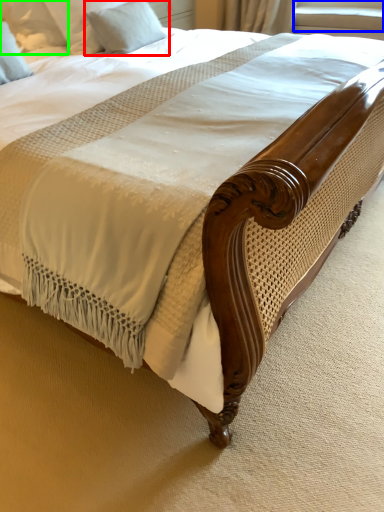
Question: Which object is positioned farthest from pillow (highlighted by a red box)? Select from window screen (highlighted by a blue box) and pillow (highlighted by a green box).

Choices:
 (A) window screen
 (B) pillow

Answer: (A)